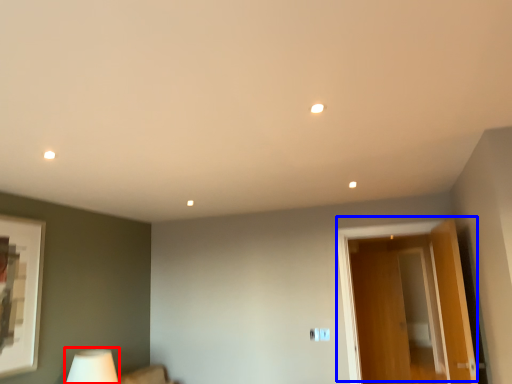
Question: Which object is further to the camera taking this photo, table lamp (highlighted by a red box) or door (highlighted by a blue box)?

Choices:
 (A) table lamp
 (B) door

Answer: (B)